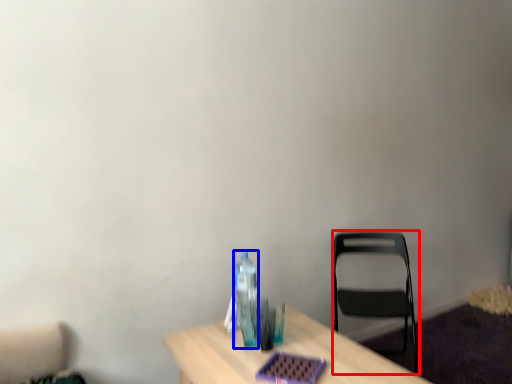
Question: Among these objects, which one is nearest to the camera, chair (highlighted by a red box) or bottle (highlighted by a blue box)?

Choices:
 (A) chair
 (B) bottle

Answer: (B)